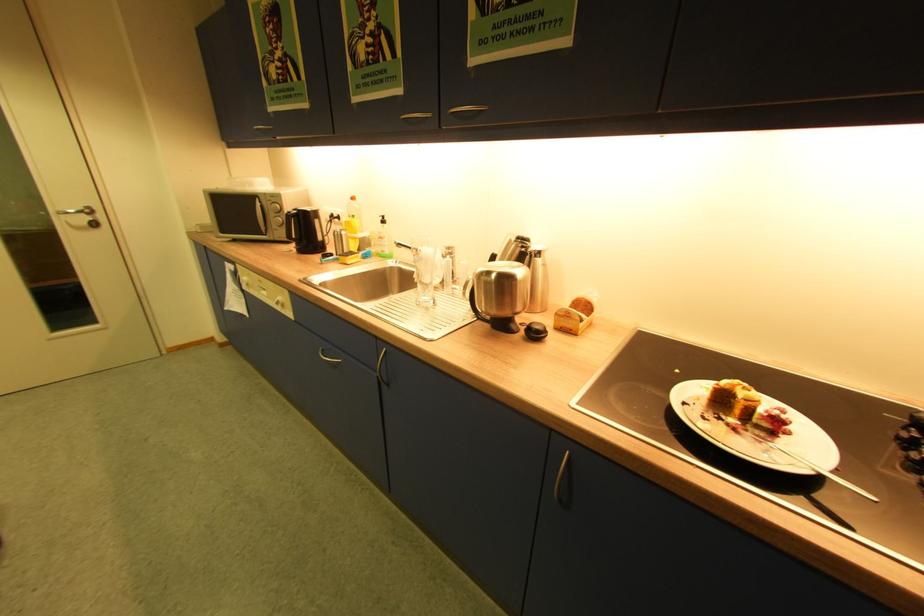
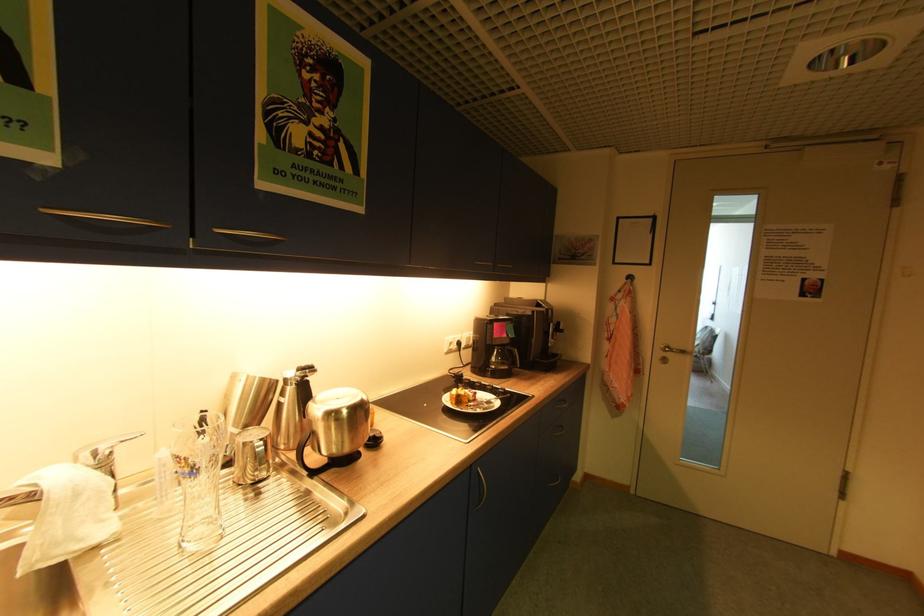
Where in the second image is the point corresponding to the point at 543,261 from the first image?

(308, 386)